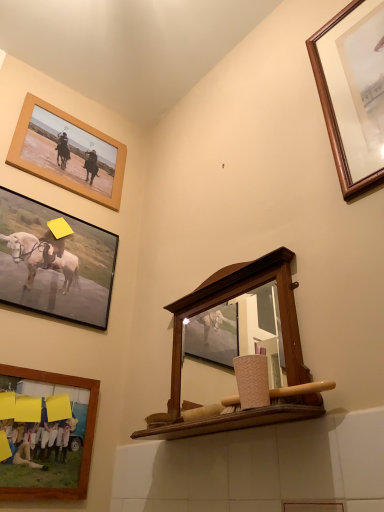
Question: Is wooden picture frame at upper right, which is counted as the first picture frame, starting from the right, inside the boundaries of wooden frame at upper left, marked as the first picture frame in a left-to-right arrangement, or outside?

Choices:
 (A) inside
 (B) outside

Answer: (B)

Question: Considering the positions of wooden picture frame at upper right, which is counted as the first picture frame, starting from the right, and wooden frame at upper left, which is the fourth picture frame in right-to-left order, in the image, is wooden picture frame at upper right, which is counted as the first picture frame, starting from the right, wider or thinner than wooden frame at upper left, which is the fourth picture frame in right-to-left order,?

Choices:
 (A) thin
 (B) wide

Answer: (B)

Question: Which object is positioned farthest from the wooden picture frame at upper right, the fourth picture frame in the left-to-right sequence?

Choices:
 (A) wooden-framed picture at lower left, the 2th picture frame viewed from the right
 (B) matte black frame at upper left, which appears as the third picture frame when viewed from the right
 (C) wooden frame at upper left, marked as the first picture frame in a left-to-right arrangement
 (D) wooden mirror at center

Answer: (A)

Question: Considering the real-world distances, which object is closest to the wooden frame at upper left, marked as the first picture frame in a left-to-right arrangement?

Choices:
 (A) wooden-framed picture at lower left, the third picture frame positioned from the left
 (B) matte black frame at upper left, which ranks as the second picture frame in left-to-right order
 (C) wooden picture frame at upper right, the fourth picture frame in the left-to-right sequence
 (D) wooden mirror at center

Answer: (B)